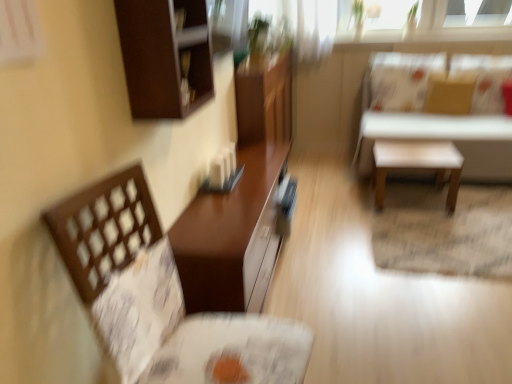
Identify the location of blank space above matte brown table at center, which is the first table from left to right (from a real-world perspective). (231, 192).